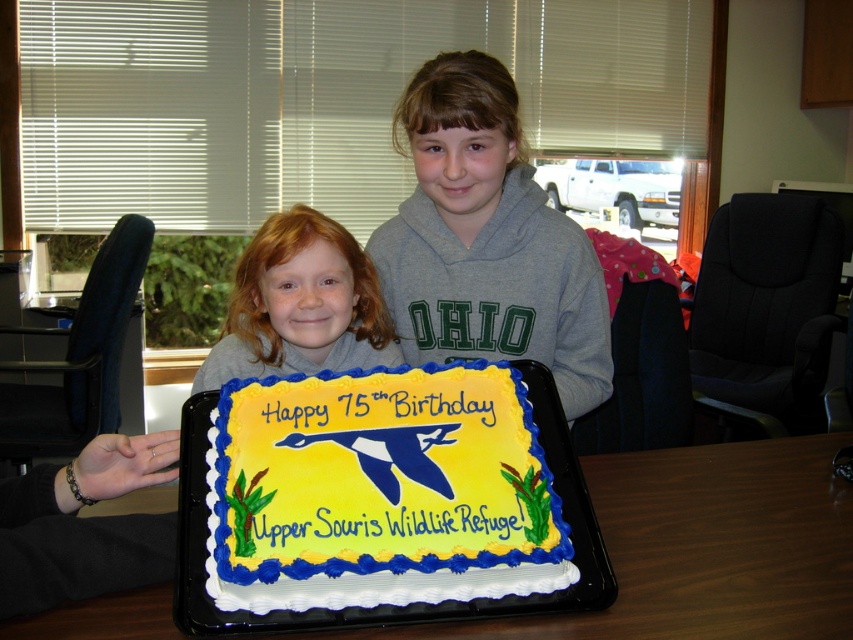
You are a photographer taking a picture of the cake on the white plastic tray at lower center and the person with blonde hair at center. Which object is closer to the camera?

The white plastic tray at lower center is closer to the camera than the blonde hair at center.

You are organizing a birthday celebration and need to place a large banner behind both the yellow fondant cake at center and the gray fleece sweatshirt at center. Which object should be placed closer to the banner to ensure both are visible?

The yellow fondant cake at center should be placed closer to the banner since it is shorter than the gray fleece sweatshirt at center, allowing both to be visible behind the banner.